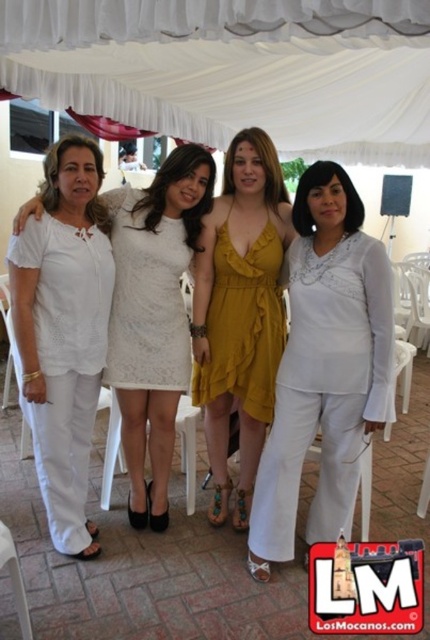
Which is more to the right, white fabric canopy at upper center or lace white dress at center?

lace white dress at center

Between point (405, 138) and point (129, 353), which one is positioned behind?

Point (405, 138)

This screenshot has height=640, width=430. What are the coordinates of `white fabric canopy at upper center` in the screenshot? It's located at (233, 68).

Does yellow fabric dress at center have a smaller size compared to white lace dress at center?

Actually, yellow fabric dress at center might be larger than white lace dress at center.

Between point (242, 248) and point (162, 468), which one is positioned behind?

The point (162, 468) is behind.

The height and width of the screenshot is (640, 430). What do you see at coordinates (239, 312) in the screenshot?
I see `yellow fabric dress at center` at bounding box center [239, 312].

At what (x,y) coordinates should I click in order to perform the action: click on yellow fabric dress at center. Please return your answer as a coordinate pair (x, y). The height and width of the screenshot is (640, 430). Looking at the image, I should click on (239, 312).

Consider the image. Does white matte pants at center come in front of white lace dress at center?

Yes, white matte pants at center is in front of white lace dress at center.

Does white matte pants at center appear over white lace dress at center?

No.

Who is more forward, [83,387] or [168,451]?

Point [83,387] is more forward.

I want to click on white matte pants at center, so click(x=64, y=332).